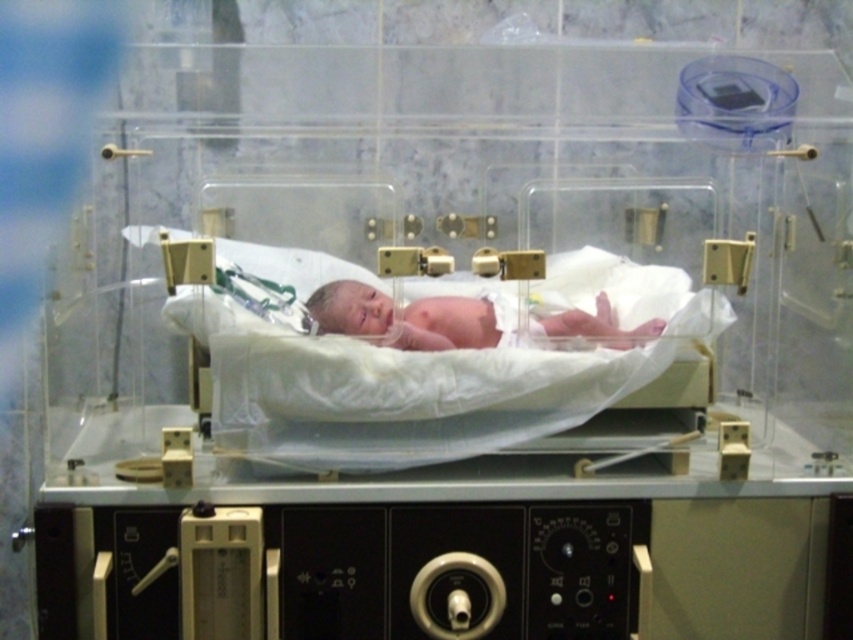
You are a nurse checking on a newborn in an incubator. You notice the white fabric hospital bed at center and the pink smooth skin at center. Which object is located underneath the other?

The white fabric hospital bed at center is positioned over the pink smooth skin at center, so the pink smooth skin at center is underneath the white fabric hospital bed at center.

Looking at this image, you are a nurse in the neonatal unit. You need to place a small medical tool on the surface that is higher between the white fabric hospital bed at center and the pink smooth skin at center. Which one should you choose?

The white fabric hospital bed at center has a greater height compared to pink smooth skin at center, so you should place the medical tool on the white fabric hospital bed at center.